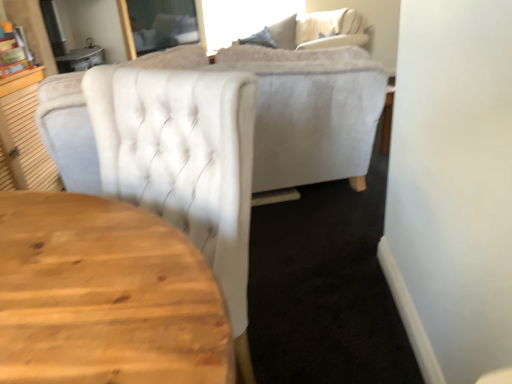
This screenshot has height=384, width=512. What do you see at coordinates (301, 35) in the screenshot?
I see `velvet beige couch at upper center` at bounding box center [301, 35].

Where is `velvet beige couch at upper center`? This screenshot has width=512, height=384. velvet beige couch at upper center is located at coordinates (301, 35).

You are a GUI agent. You are given a task and a screenshot of the screen. Output one action in this format:
    pyautogui.click(x=<x>, y=<y>)
    Task: Click on the white tufted chair at upper center
    
    Given the screenshot: What is the action you would take?
    pyautogui.click(x=170, y=155)

This screenshot has width=512, height=384. What do you see at coordinates (170, 155) in the screenshot?
I see `white tufted chair at upper center` at bounding box center [170, 155].

At what (x,y) coordinates should I click in order to perform the action: click on velvet beige couch at upper center. Please return your answer as a coordinate pair (x, y). Looking at the image, I should click on (301, 35).

In the image, is white tufted chair at upper center on the left side or the right side of velvet beige couch at upper center?

From the image, it's evident that white tufted chair at upper center is to the left of velvet beige couch at upper center.

Looking at this image, does white tufted chair at upper center lie in front of velvet beige couch at upper center?

That is True.

Is point (225, 90) more distant than point (307, 24)?

No.

From the image's perspective, which object appears higher, white tufted chair at upper center or velvet beige couch at upper center?

From the image's view, velvet beige couch at upper center is above.

From a real-world perspective, is white tufted chair at upper center positioned under velvet beige couch at upper center based on gravity?

Incorrect, from a real-world perspective, white tufted chair at upper center is higher than velvet beige couch at upper center.

Does white tufted chair at upper center have a lesser width compared to velvet beige couch at upper center?

Yes.

Considering the sizes of objects white tufted chair at upper center and velvet beige couch at upper center in the image provided, who is taller, white tufted chair at upper center or velvet beige couch at upper center?

With more height is white tufted chair at upper center.

Is white tufted chair at upper center smaller than velvet beige couch at upper center?

Indeed, white tufted chair at upper center has a smaller size compared to velvet beige couch at upper center.

Is white tufted chair at upper center completely or partially outside of velvet beige couch at upper center?

Yes, white tufted chair at upper center is outside of velvet beige couch at upper center.

Is white tufted chair at upper center in contact with velvet beige couch at upper center?

No.

Is white tufted chair at upper center looking in the opposite direction of velvet beige couch at upper center?

No, white tufted chair at upper center is not facing away from velvet beige couch at upper center.

How much distance is there between white tufted chair at upper center and velvet beige couch at upper center?

white tufted chair at upper center is 9.45 feet from velvet beige couch at upper center.

Image resolution: width=512 pixels, height=384 pixels. What are the coordinates of `chair that appears in front of the velvet beige couch at upper center` in the screenshot? It's located at (170, 155).

In the image, is velvet beige couch at upper center on the left side or the right side of white tufted chair at upper center?

Clearly, velvet beige couch at upper center is on the right of white tufted chair at upper center in the image.

Considering their positions, is velvet beige couch at upper center located in front of or behind white tufted chair at upper center?

Clearly, velvet beige couch at upper center is behind white tufted chair at upper center.

Is point (345, 21) closer or farther from the camera than point (158, 101)?

Clearly, point (345, 21) is more distant from the camera than point (158, 101).

From the image's perspective, is velvet beige couch at upper center over white tufted chair at upper center?

Correct, velvet beige couch at upper center appears higher than white tufted chair at upper center in the image.

From a real-world perspective, is velvet beige couch at upper center under white tufted chair at upper center?

Yes, from a real-world perspective, velvet beige couch at upper center is under white tufted chair at upper center.

Considering the relative sizes of velvet beige couch at upper center and white tufted chair at upper center in the image provided, is velvet beige couch at upper center wider than white tufted chair at upper center?

Yes, velvet beige couch at upper center is wider than white tufted chair at upper center.

Is velvet beige couch at upper center shorter than white tufted chair at upper center?

Yes, velvet beige couch at upper center is shorter than white tufted chair at upper center.

Does velvet beige couch at upper center have a smaller size compared to white tufted chair at upper center?

No.

Is velvet beige couch at upper center outside of white tufted chair at upper center?

Yes, velvet beige couch at upper center is located beyond the bounds of white tufted chair at upper center.

Are velvet beige couch at upper center and white tufted chair at upper center far apart?

That's right, there is a large distance between velvet beige couch at upper center and white tufted chair at upper center.

Is velvet beige couch at upper center facing towards white tufted chair at upper center?

No, velvet beige couch at upper center is not facing towards white tufted chair at upper center.

Measure the distance between velvet beige couch at upper center and white tufted chair at upper center.

velvet beige couch at upper center is 2.88 meters away from white tufted chair at upper center.

The width and height of the screenshot is (512, 384). What are the coordinates of `couch behind the white tufted chair at upper center` in the screenshot? It's located at (301, 35).

Identify the location of chair above the velvet beige couch at upper center (from a real-world perspective). The width and height of the screenshot is (512, 384). pyautogui.click(x=170, y=155).

You are a GUI agent. You are given a task and a screenshot of the screen. Output one action in this format:
    pyautogui.click(x=<x>, y=<y>)
    Task: Click on the couch beneath the white tufted chair at upper center (from a real-world perspective)
    
    Given the screenshot: What is the action you would take?
    click(x=301, y=35)